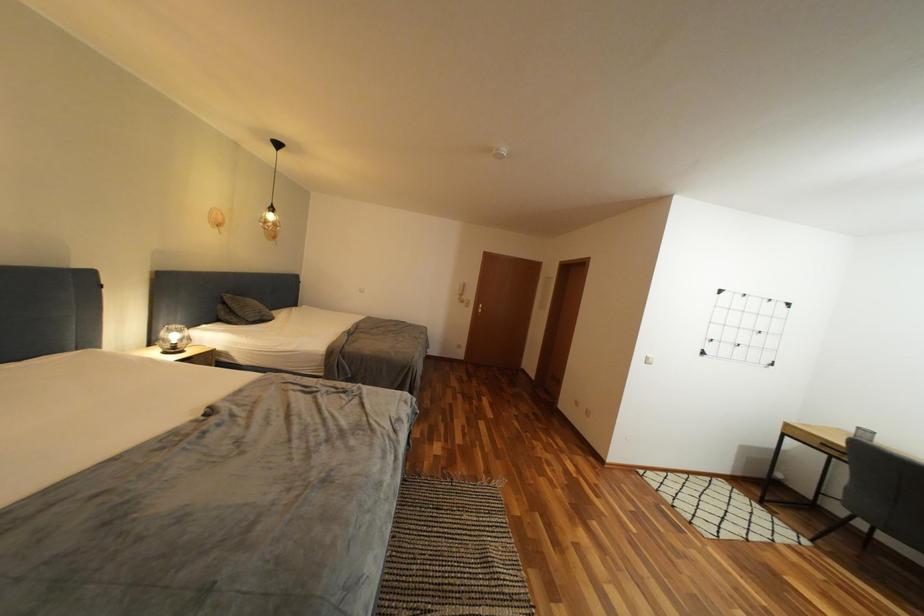
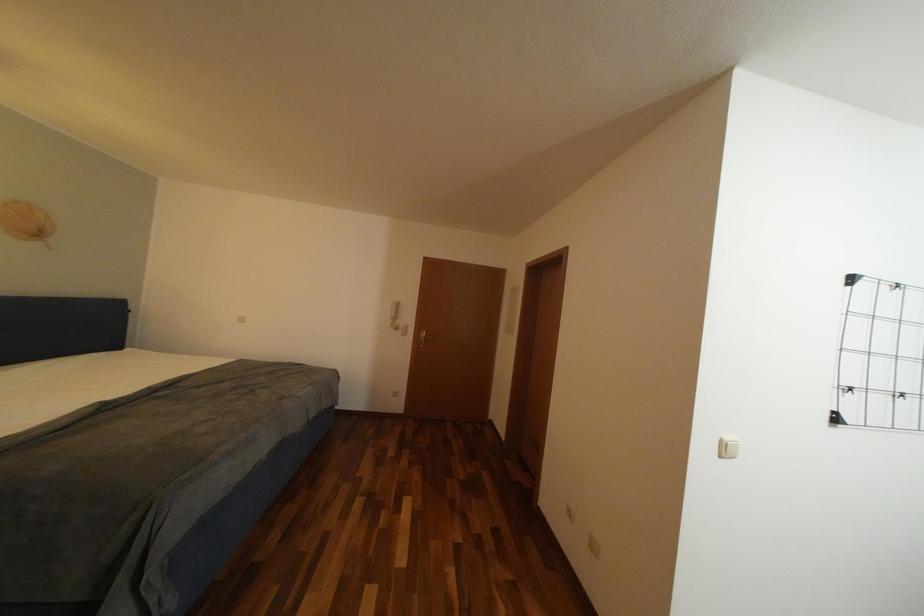
What movement of the cameraman would produce the second image?

The cameraman walked toward right, forward.